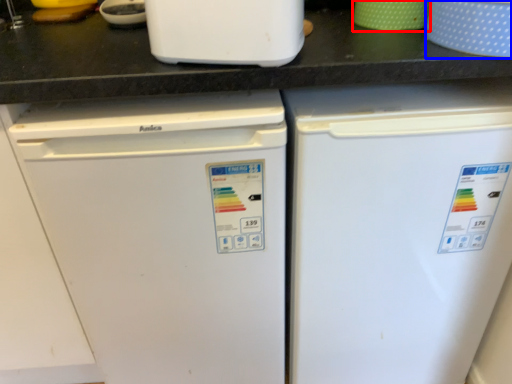
Question: Which point is further to the camera, appliance (highlighted by a red box) or appliance (highlighted by a blue box)?

Choices:
 (A) appliance
 (B) appliance

Answer: (A)